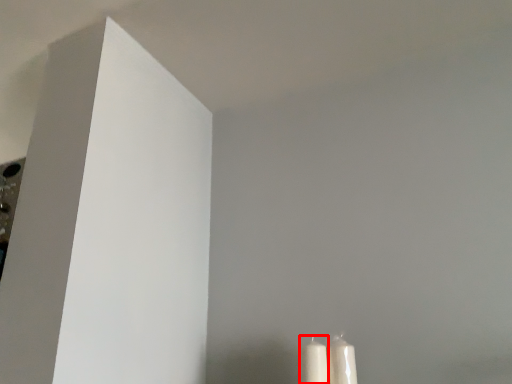
Question: From the image's perspective, where is candle (annotated by the red box) located relative to candle?

Choices:
 (A) below
 (B) above

Answer: (A)